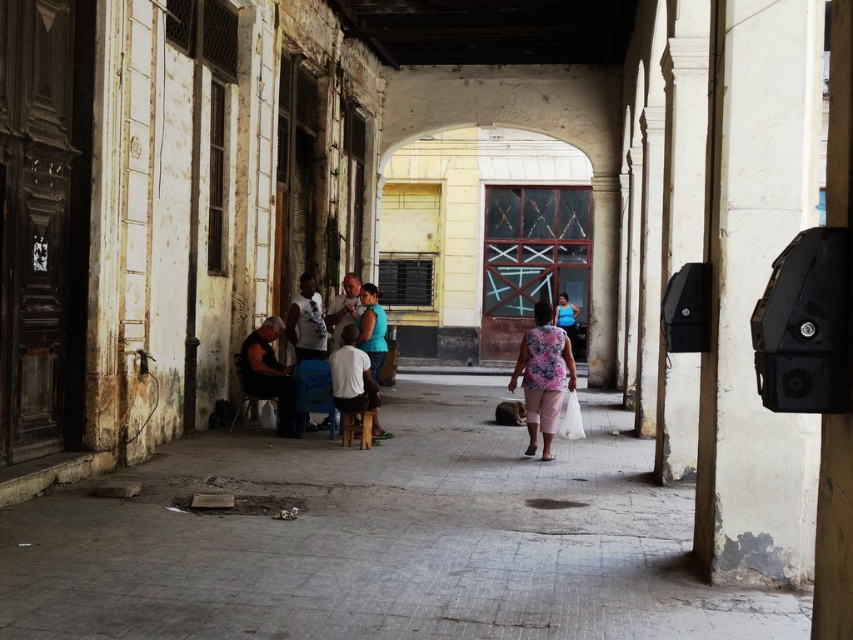
You are a delivery person carrying a heavy box and need to navigate through the corridor. You see the concrete floor at center and the wooden stool at center. Which object should you avoid stepping on to ensure stability?

You should avoid stepping on the wooden stool at center because the concrete floor at center is to the right of it, meaning the stool is positioned to the left. Since the corridor is narrow, stepping on the stool might obstruct your path or cause instability.

You are a delivery person carrying a large package that is 1 meter wide. You need to walk through the corridor shown in the image. There is a floral fabric dress at center and a wooden stool at center in your path. Can you pass through without moving either object?

The floral fabric dress at center might be wider than the wooden stool at center. Since the package is 1 meter wide, it depends on the actual width of the dress. If the dress is wider than the stool, the narrowest point between them may be narrower than 1 meter, making it difficult to pass. However, without exact measurements, it is uncertain.